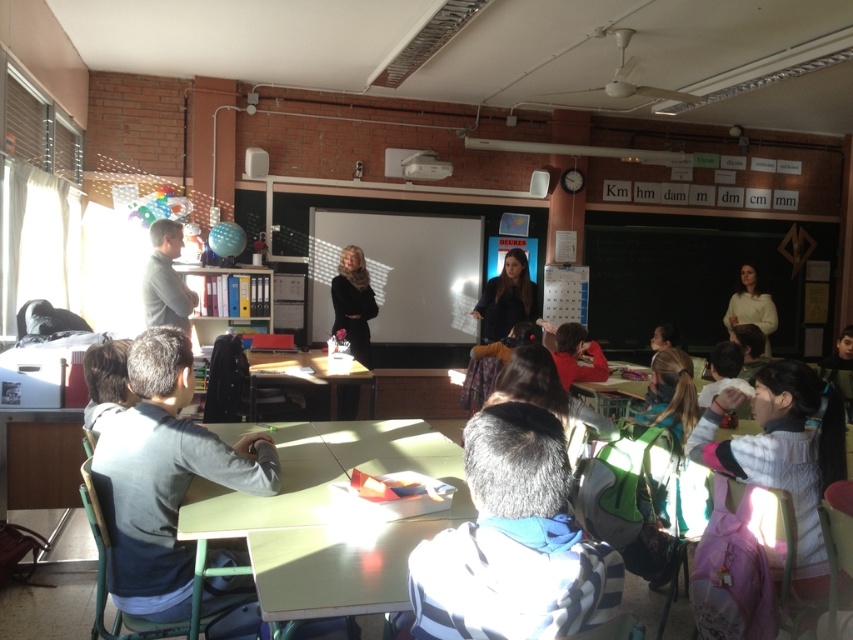
Is black matte sweater at center wider than matte gray shirt at left?

Yes.

Which is more to the left, black matte sweater at center or matte gray shirt at left?

matte gray shirt at left is more to the left.

In the scene shown: Who is more forward, (x=346, y=276) or (x=177, y=282)?

Point (x=177, y=282) is in front.

Where is `black matte sweater at center`? black matte sweater at center is located at coordinates click(x=352, y=301).

Which is behind, point (288, 529) or point (131, 545)?

Point (131, 545)

What do you see at coordinates (331, 518) in the screenshot? This screenshot has width=853, height=640. I see `green matte table at center` at bounding box center [331, 518].

The height and width of the screenshot is (640, 853). What are the coordinates of `green matte table at center` in the screenshot? It's located at point(331,518).

Can you confirm if gray matte shirt at lower left is thinner than matte black jacket at center?

Yes, gray matte shirt at lower left is thinner than matte black jacket at center.

Measure the distance from gray matte shirt at lower left to matte black jacket at center.

The distance of gray matte shirt at lower left from matte black jacket at center is 12.81 feet.

Is point (138, 540) farther from viewer compared to point (482, 300)?

That is False.

Where is `gray matte shirt at lower left`? gray matte shirt at lower left is located at coordinates (164, 477).